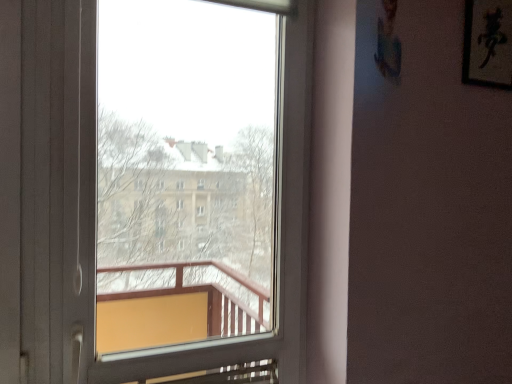
Question: Based on their positions, is transparent glass window at center located to the left or right of black paper at upper right?

Choices:
 (A) right
 (B) left

Answer: (B)

Question: From the image's perspective, relative to black paper at upper right, is transparent glass window at center above or below?

Choices:
 (A) above
 (B) below

Answer: (B)

Question: Is transparent glass window at center in front of or behind black paper at upper right in the image?

Choices:
 (A) behind
 (B) front

Answer: (B)

Question: Considering the positions of point (487, 59) and point (283, 97), is point (487, 59) closer or farther from the camera than point (283, 97)?

Choices:
 (A) closer
 (B) farther

Answer: (B)

Question: Is black paper at upper right taller or shorter than transparent glass window at center?

Choices:
 (A) short
 (B) tall

Answer: (A)

Question: Would you say black paper at upper right is inside or outside transparent glass window at center?

Choices:
 (A) inside
 (B) outside

Answer: (B)

Question: Based on their sizes in the image, would you say black paper at upper right is bigger or smaller than transparent glass window at center?

Choices:
 (A) small
 (B) big

Answer: (A)